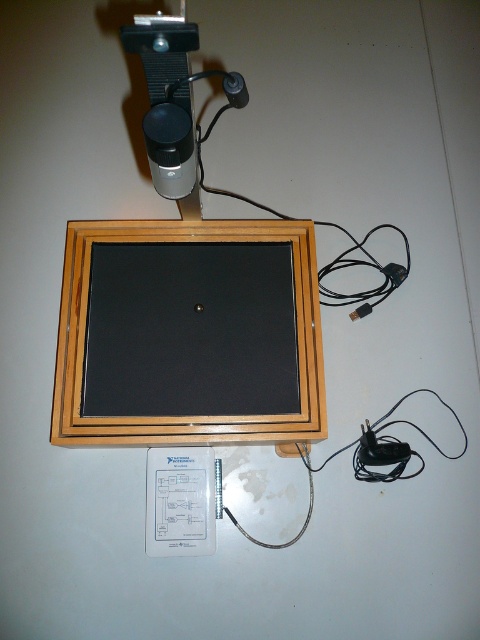
Question: Which point appears farthest from the camera in this image?

Choices:
 (A) (228, 84)
 (B) (207, 225)

Answer: (B)

Question: Is the position of wooden frame at center more distant than that of black plastic plug at upper center?

Choices:
 (A) yes
 (B) no

Answer: (A)

Question: Which point is closer to the camera?

Choices:
 (A) (230, 74)
 (B) (195, 266)

Answer: (A)

Question: Is wooden frame at center in front of black plastic plug at upper center?

Choices:
 (A) yes
 (B) no

Answer: (B)

Question: From the image, what is the correct spatial relationship of wooden frame at center in relation to black plastic plug at upper center?

Choices:
 (A) above
 (B) below

Answer: (B)

Question: Which object appears farthest from the camera in this image?

Choices:
 (A) wooden frame at center
 (B) black plastic plug at upper center

Answer: (A)